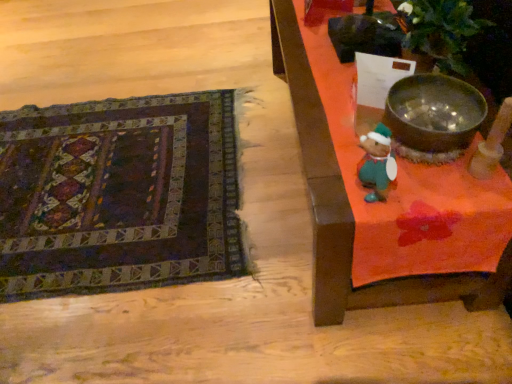
You are a GUI agent. You are given a task and a screenshot of the screen. Output one action in this format:
    pyautogui.click(x=<x>, y=<y>)
    Task: Click on the free space that is in between wooden table at right and dark woven rug at lower left
    The image size is (512, 384).
    Given the screenshot: What is the action you would take?
    pyautogui.click(x=227, y=292)